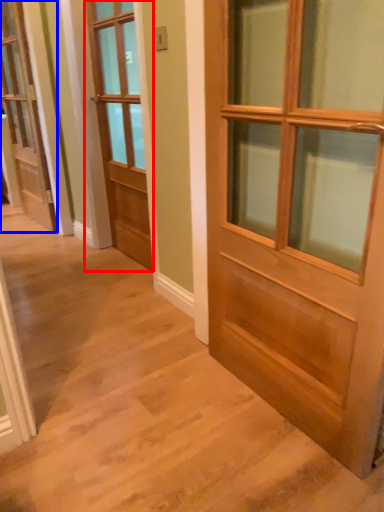
Question: Which of the following is the farthest to the observer, door (highlighted by a red box) or door (highlighted by a blue box)?

Choices:
 (A) door
 (B) door

Answer: (B)